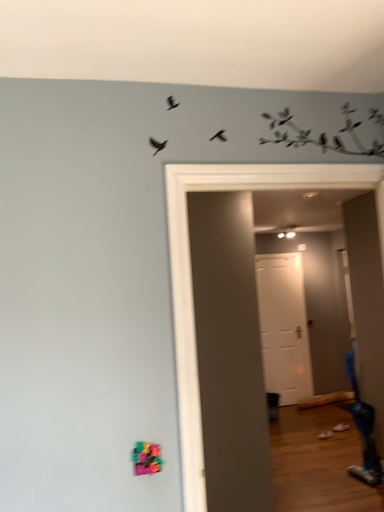
Question: From a real-world perspective, is blue plastic swivel chair at lower right physically located above or below white matte door at center?

Choices:
 (A) above
 (B) below

Answer: (B)

Question: Considering the positions of blue plastic swivel chair at lower right and white matte door at center in the image, is blue plastic swivel chair at lower right taller or shorter than white matte door at center?

Choices:
 (A) short
 (B) tall

Answer: (A)

Question: In terms of width, does blue plastic swivel chair at lower right look wider or thinner when compared to white matte door at center?

Choices:
 (A) thin
 (B) wide

Answer: (B)

Question: From the image's perspective, relative to blue plastic swivel chair at lower right, is white matte door at center above or below?

Choices:
 (A) below
 (B) above

Answer: (B)

Question: From a real-world perspective, is white matte door at center above or below blue plastic swivel chair at lower right?

Choices:
 (A) above
 (B) below

Answer: (A)

Question: Considering the positions of white matte door at center and blue plastic swivel chair at lower right in the image, is white matte door at center bigger or smaller than blue plastic swivel chair at lower right?

Choices:
 (A) big
 (B) small

Answer: (A)

Question: Is point (259, 318) closer or farther from the camera than point (369, 424)?

Choices:
 (A) closer
 (B) farther

Answer: (B)